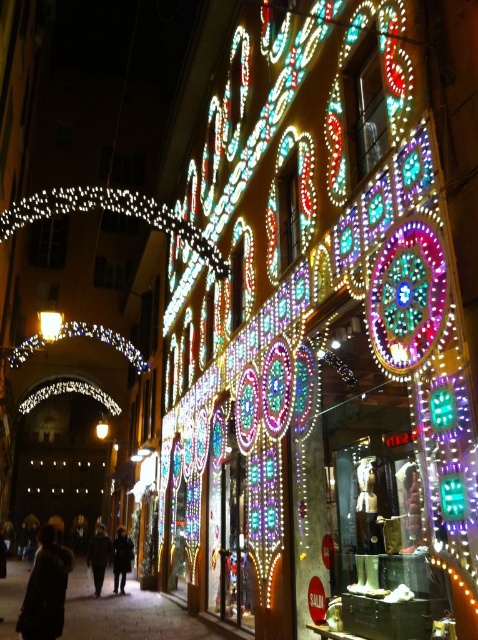
Question: Is dark wool coat at lower left wider than dark gray coat at lower left?

Choices:
 (A) no
 (B) yes

Answer: (B)

Question: Where is dark wool coat at lower left located in relation to dark brown coat at center in the image?

Choices:
 (A) right
 (B) left

Answer: (B)

Question: Which point is closer to the camera?

Choices:
 (A) dark brown coat at center
 (B) dark wool coat at lower left
 (C) dark gray coat at lower left

Answer: (B)

Question: Does dark wool coat at lower left have a smaller size compared to dark gray coat at lower left?

Choices:
 (A) yes
 (B) no

Answer: (B)

Question: Which is farther from the dark brown coat at center?

Choices:
 (A) dark wool coat at lower left
 (B) dark gray coat at lower left

Answer: (A)

Question: Which of the following is the closest to the observer?

Choices:
 (A) dark gray coat at lower left
 (B) dark brown coat at center
 (C) dark wool coat at lower left

Answer: (C)